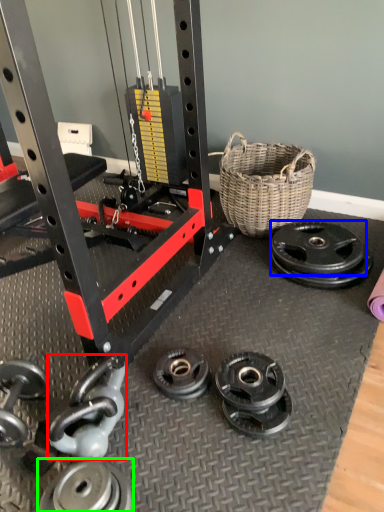
Question: Based on their relative distances, which object is nearer to dumbbell (highlighted by a red box)? Choose from wheel (highlighted by a blue box) and wheel (highlighted by a green box).

Choices:
 (A) wheel
 (B) wheel

Answer: (B)